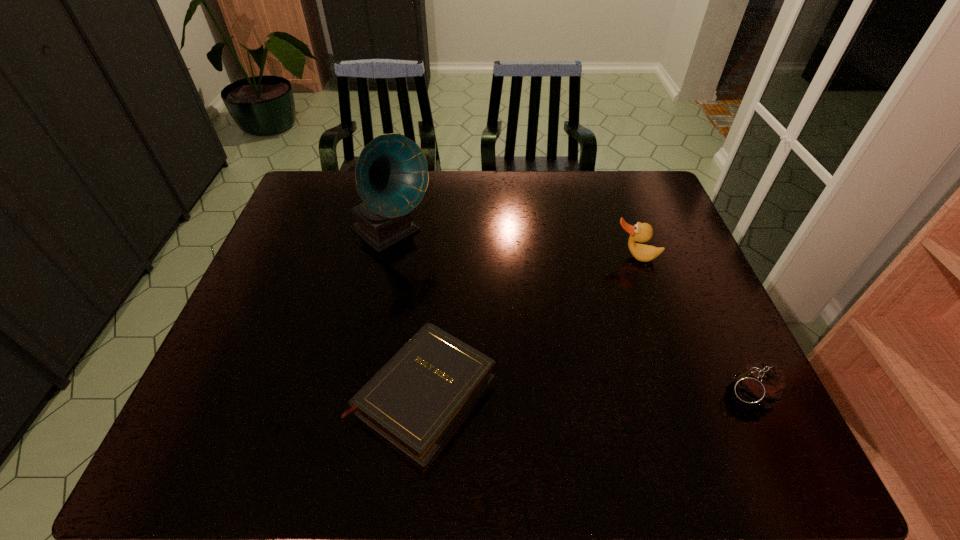
This screenshot has height=540, width=960. Find the location of `free space in the image that satisfies the following two spatial constraints: 1. on the front side of the second object from right to left; 2. with a leaf charm attached to the third tallest object`. free space in the image that satisfies the following two spatial constraints: 1. on the front side of the second object from right to left; 2. with a leaf charm attached to the third tallest object is located at coordinates (683, 393).